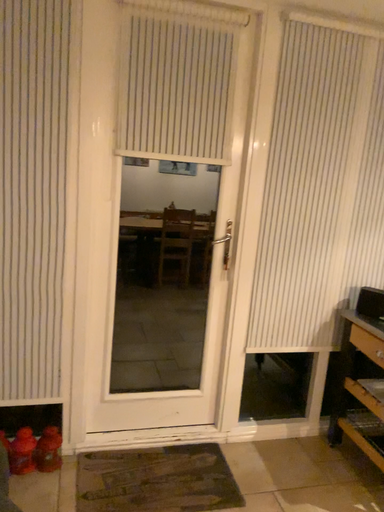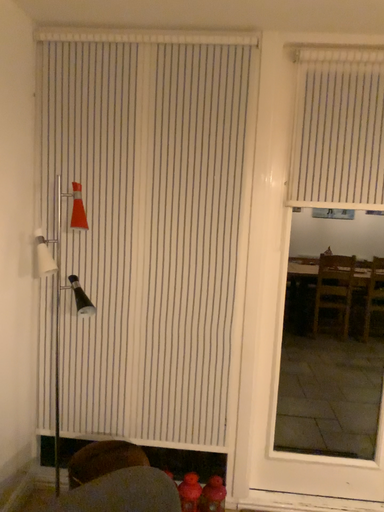
Question: Which way did the camera rotate in the video?

Choices:
 (A) rotated right
 (B) rotated left

Answer: (B)